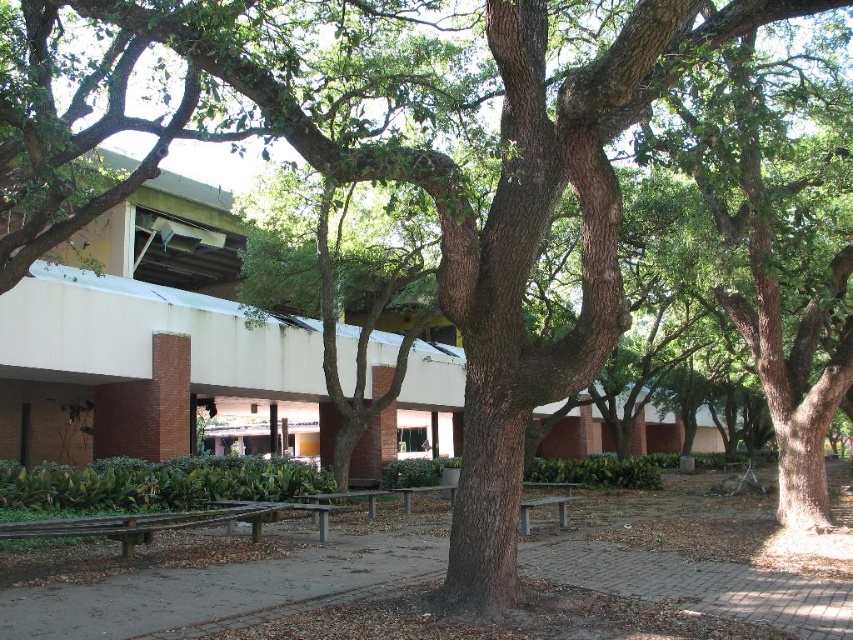
Who is more distant from viewer, (328, 497) or (567, 499)?

The point (567, 499) is more distant.

Is wooden bench at center smaller than gray wood park bench at center?

Yes, wooden bench at center is smaller than gray wood park bench at center.

In order to click on wooden bench at center in this screenshot , I will do `click(345, 497)`.

Describe the element at coordinates (345, 497) in the screenshot. I see `wooden bench at center` at that location.

Which is above, wooden bench at center or wooden park bench at center?

wooden bench at center is above.

Between point (325, 493) and point (410, 492), which one is positioned in front?

Point (325, 493) is in front.

Find the location of a particular element. Image resolution: width=853 pixels, height=640 pixels. wooden bench at center is located at coordinates (345, 497).

Does gray wood park bench at center appear on the left side of wooden park bench at center?

No, gray wood park bench at center is not to the left of wooden park bench at center.

Which is in front, point (543, 506) or point (450, 496)?

Point (543, 506)

I want to click on gray wood park bench at center, so click(543, 506).